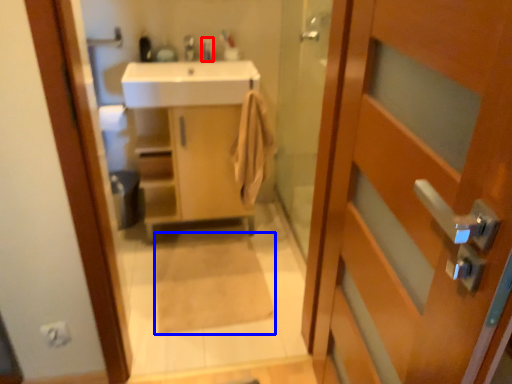
Question: Which point is further to the camera, toiletry (highlighted by a red box) or bath mat (highlighted by a blue box)?

Choices:
 (A) toiletry
 (B) bath mat

Answer: (A)